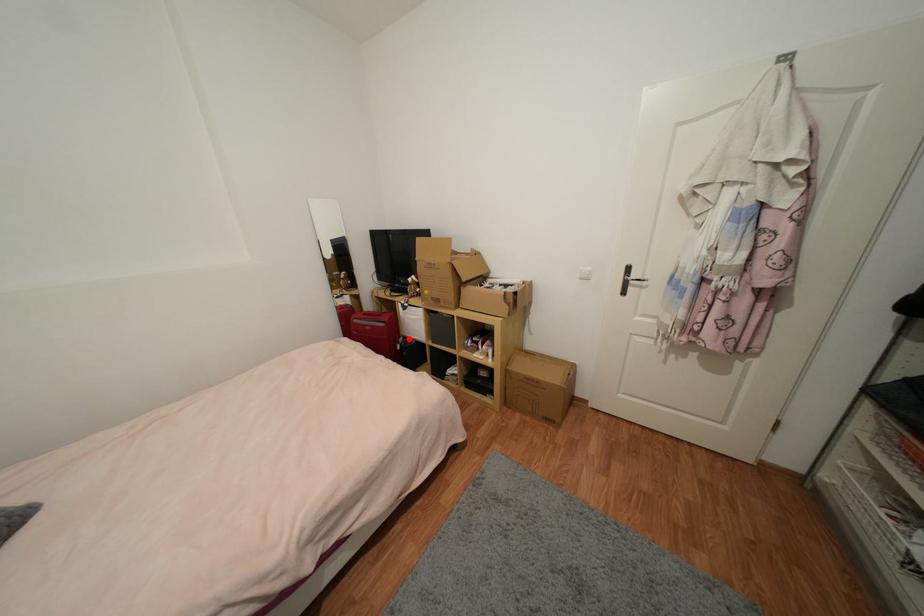
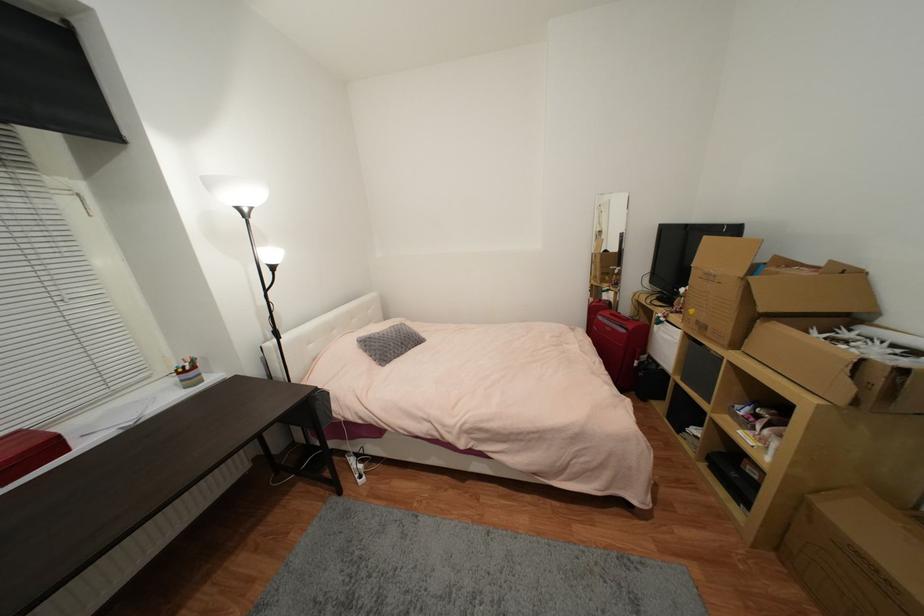
Where in the second image is the point corresponding to the highlighted location from the first image?

(653, 359)